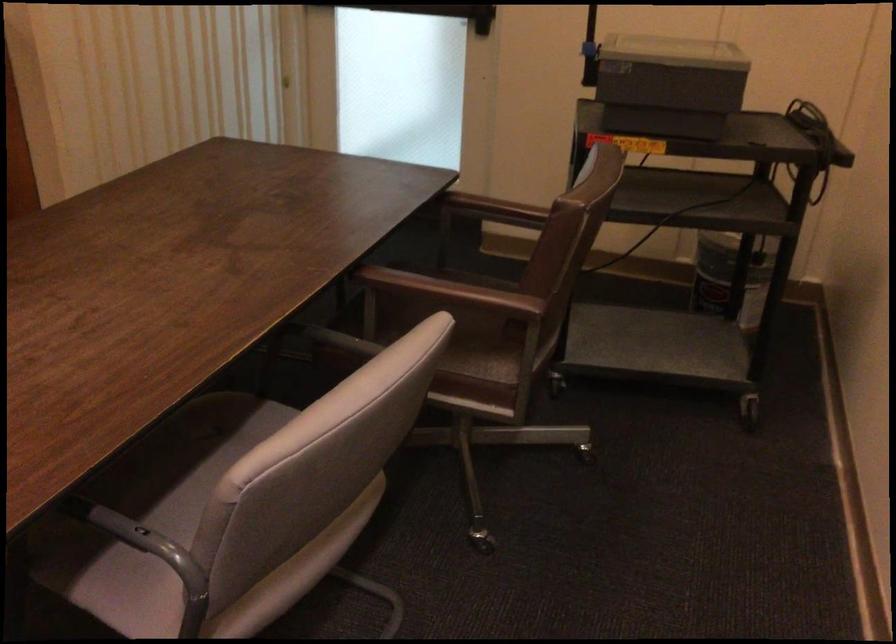
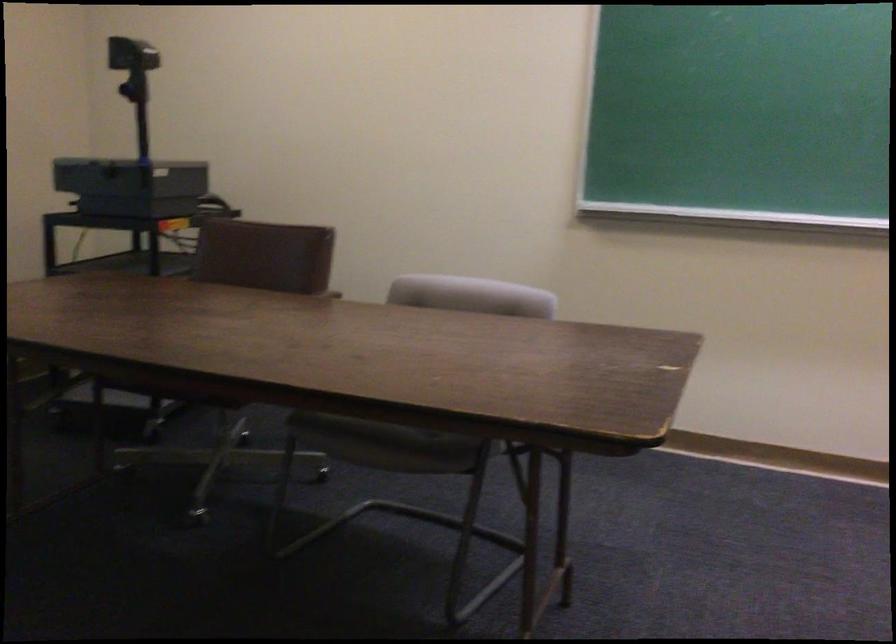
Question: I am providing you with two images of the same scene from different viewpoints. Please identify which objects are invisible in image2.

Choices:
 (A) projector head
 (B) ping-pong paddle
 (C) black overhead projector
 (D) brown chair sitting surface

Answer: (D)